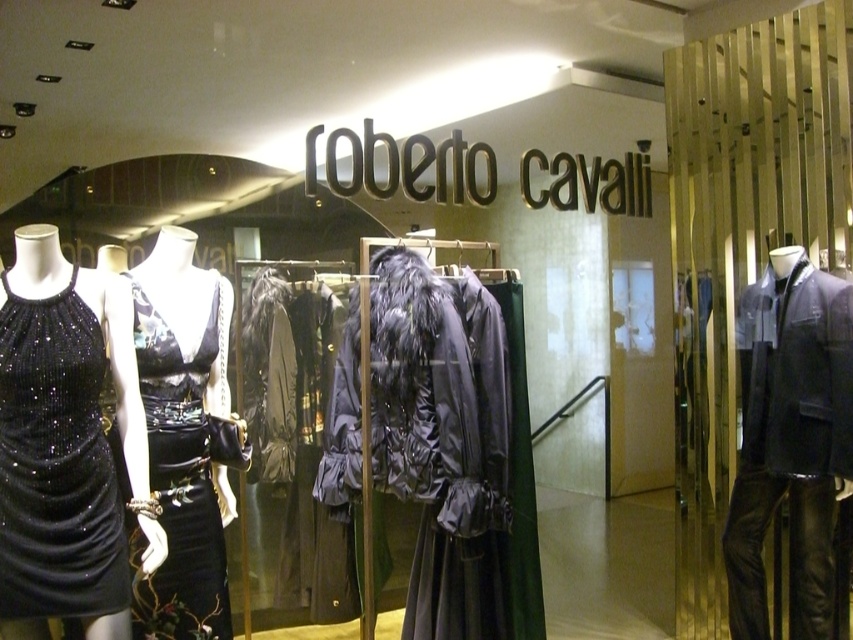
Between point (32, 336) and point (195, 573), which one is positioned in front?

Point (32, 336) is more forward.

The height and width of the screenshot is (640, 853). Describe the element at coordinates (56, 465) in the screenshot. I see `black sequined dress at left` at that location.

The image size is (853, 640). I want to click on black sequined dress at left, so click(56, 465).

Can you confirm if dark blue leather jacket at right is positioned to the right of black sequined dress at left?

Yes, dark blue leather jacket at right is to the right of black sequined dress at left.

Can you confirm if dark blue leather jacket at right is bigger than black sequined dress at left?

Yes.

I want to click on dark blue leather jacket at right, so click(x=790, y=440).

You are a GUI agent. You are given a task and a screenshot of the screen. Output one action in this format:
    pyautogui.click(x=<x>, y=<y>)
    Task: Click on the dark blue leather jacket at right
    This screenshot has width=853, height=640.
    Given the screenshot: What is the action you would take?
    pyautogui.click(x=790, y=440)

Does dark blue leather jacket at right have a lesser width compared to black satin dress at center?

No, dark blue leather jacket at right is not thinner than black satin dress at center.

Image resolution: width=853 pixels, height=640 pixels. What do you see at coordinates (790, 440) in the screenshot?
I see `dark blue leather jacket at right` at bounding box center [790, 440].

This screenshot has height=640, width=853. Identify the location of dark blue leather jacket at right. (790, 440).